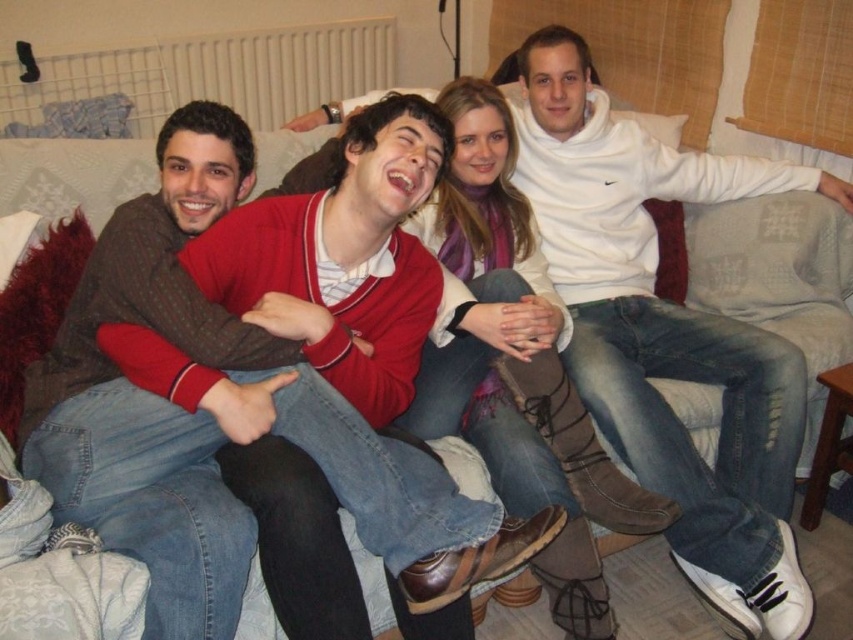
Which is below, matte red sweater at center or brown leather boots at center?

Positioned lower is matte red sweater at center.

Who is positioned more to the right, matte red sweater at center or brown leather boots at center?

brown leather boots at center

Does point (277, 324) come closer to viewer compared to point (560, 422)?

Yes, it is.

Where is `matte red sweater at center`? matte red sweater at center is located at coordinates (341, 259).